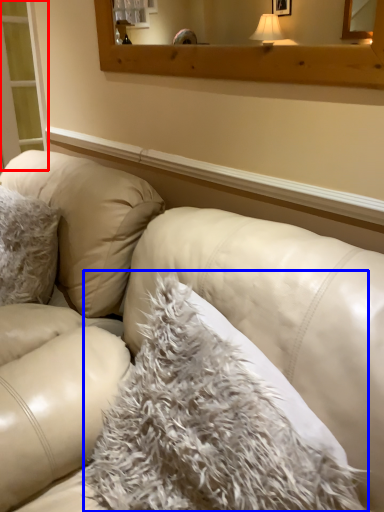
Question: Which object is further to the camera taking this photo, screen door (highlighted by a red box) or blanket (highlighted by a blue box)?

Choices:
 (A) screen door
 (B) blanket

Answer: (A)